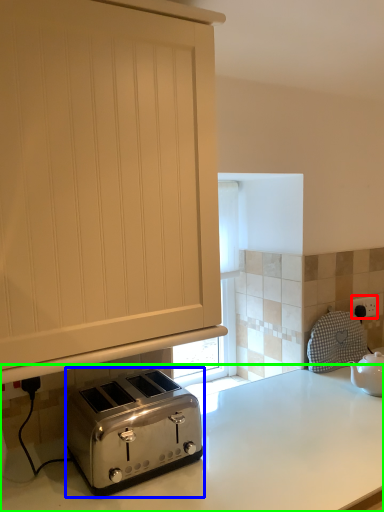
Question: Estimate the real-world distances between objects in this image. Which object is closer to electric outlet (highlighted by a red box), toaster (highlighted by a blue box) or countertop (highlighted by a green box)?

Choices:
 (A) toaster
 (B) countertop

Answer: (B)